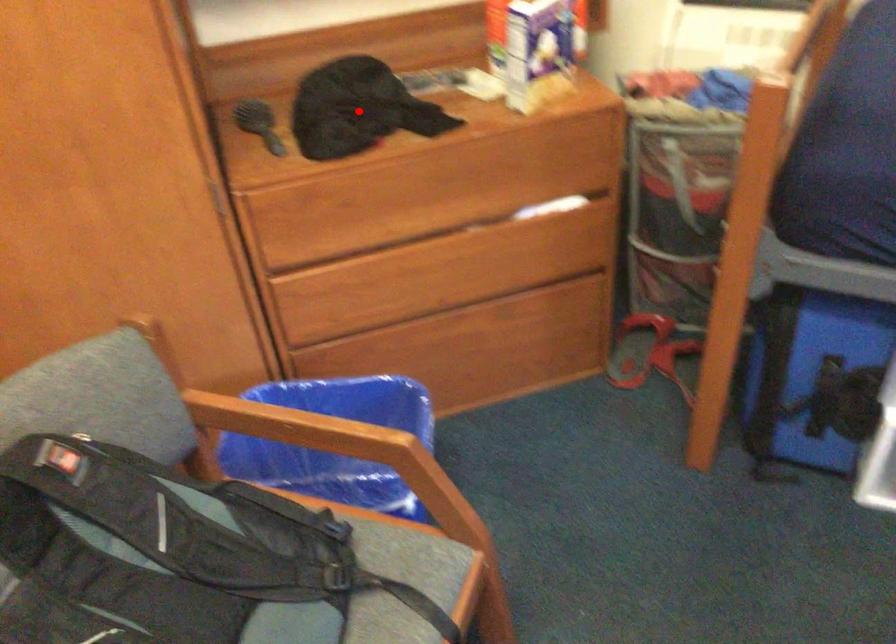
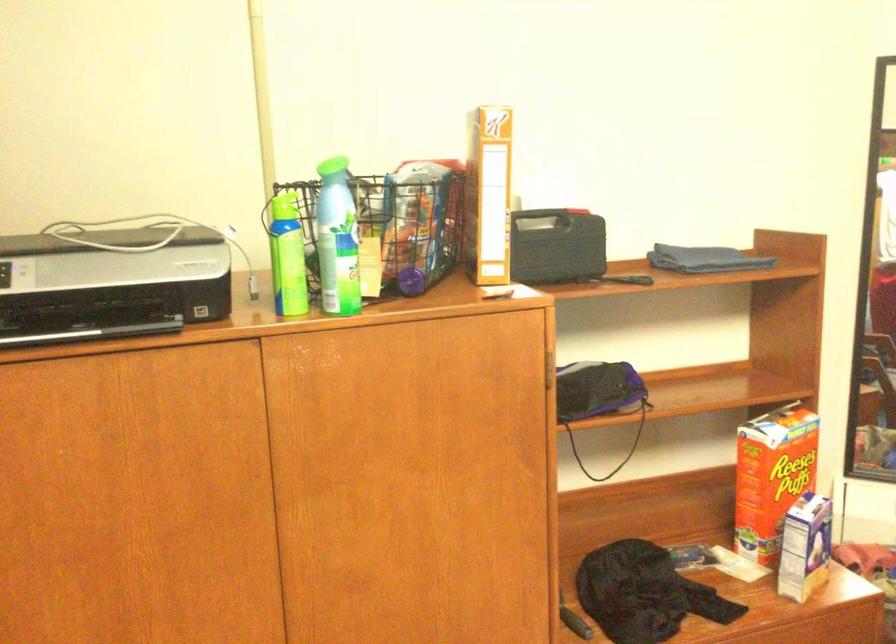
Question: I am providing you with two images of the same scene from different viewpoints. Given a red point in image1, look at the same physical point in image2. Is it:

Choices:
 (A) Closer to the viewpoint
 (B) Farther from the viewpoint

Answer: (B)